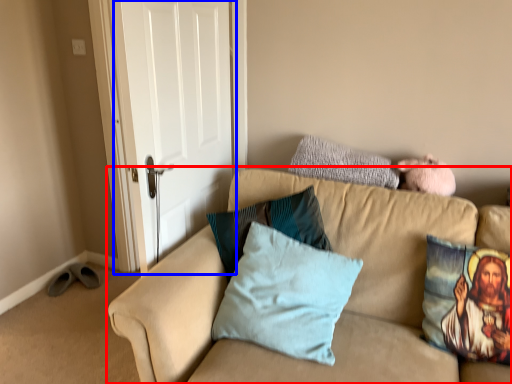
Question: Among these objects, which one is nearest to the camera, studio couch (highlighted by a red box) or door (highlighted by a blue box)?

Choices:
 (A) studio couch
 (B) door

Answer: (A)